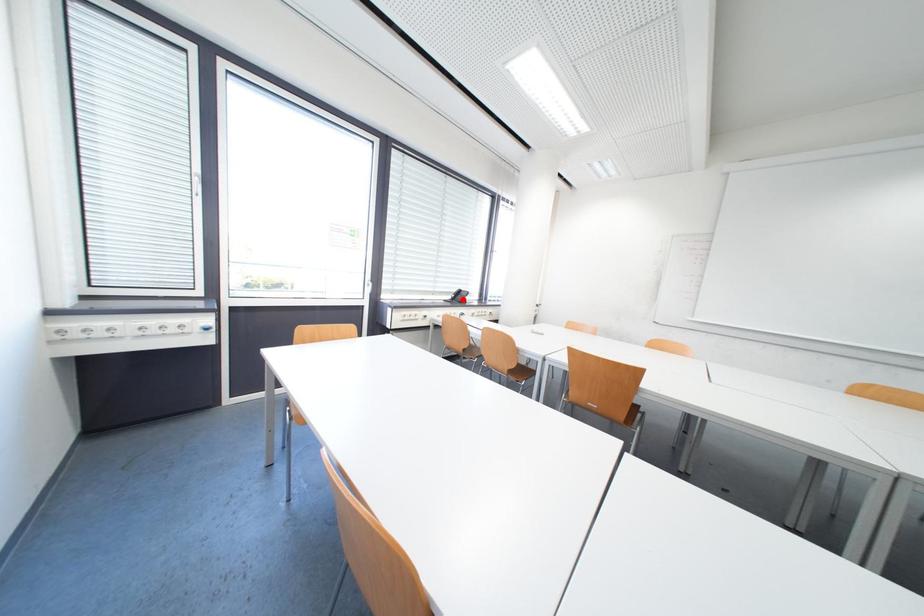
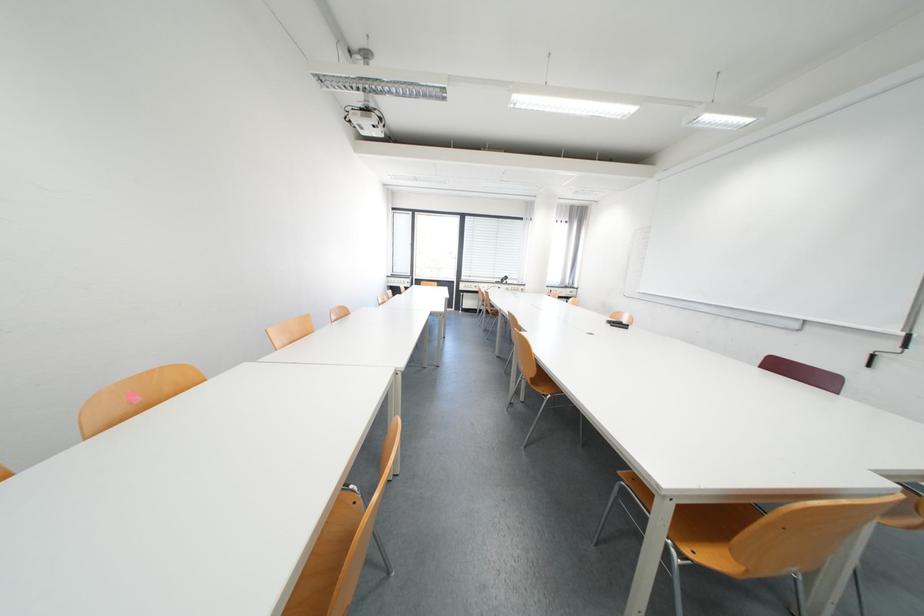
Where in the second image is the point corresponding to the highlighted location from the first image?

(512, 282)